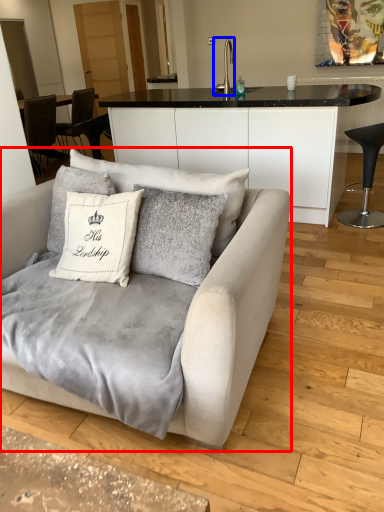
Question: Which object is closer to the camera taking this photo, studio couch (highlighted by a red box) or silver (highlighted by a blue box)?

Choices:
 (A) studio couch
 (B) silver

Answer: (A)